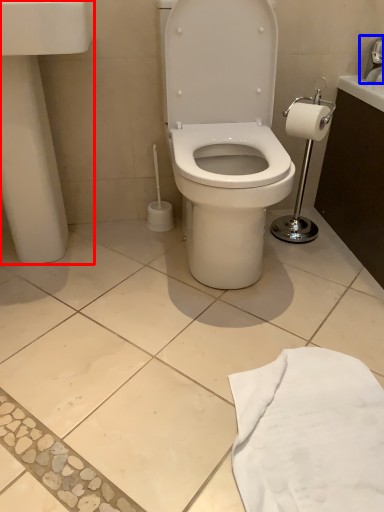
Question: Among these objects, which one is nearest to the camera, porcelain (highlighted by a red box) or faucet (highlighted by a blue box)?

Choices:
 (A) porcelain
 (B) faucet

Answer: (A)